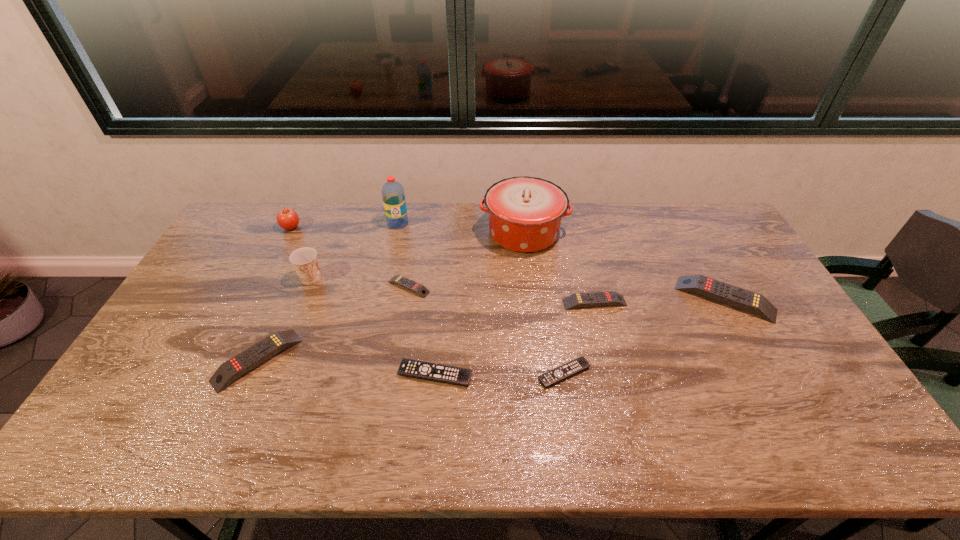
At what (x,y) coordinates should I click in order to perform the action: click on the third yellow remote control from right to left. Please return your answer as a coordinate pair (x, y). This screenshot has width=960, height=540. Looking at the image, I should click on (419, 289).

In order to click on the left black remote control in this screenshot , I will do `click(453, 375)`.

Identify the location of the right black remote control. (575, 366).

Locate an element on the screen. This screenshot has height=540, width=960. the shortest remote control is located at coordinates (575, 366).

Locate an element on the screen. vacant region located on the front label of the water bottle is located at coordinates (382, 293).

Where is `blank space located on the left of the casserole`? This screenshot has height=540, width=960. blank space located on the left of the casserole is located at coordinates (413, 233).

Find the location of a particular element. This screenshot has height=540, width=960. free spot located on the left of the Dixie cup is located at coordinates (255, 278).

Where is `free space located on the front of the apple`? free space located on the front of the apple is located at coordinates (273, 264).

Locate an element on the screen. This screenshot has width=960, height=540. free region located 0.310m on the front of the sixth shortest object is located at coordinates (793, 423).

Find the location of a particular element. Image resolution: width=960 pixels, height=540 pixels. vacant position located on the front of the sixth tallest object is located at coordinates (229, 423).